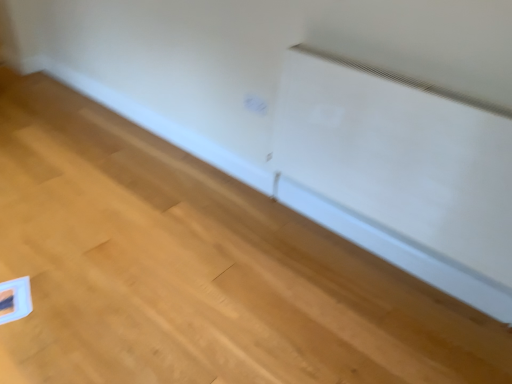
At what (x,y) coordinates should I click in order to perform the action: click on vacant space in white matte air conditioning at upper center (from a real-world perspective). Please return your answer as a coordinate pair (x, y). Image resolution: width=512 pixels, height=384 pixels. Looking at the image, I should click on (369, 259).